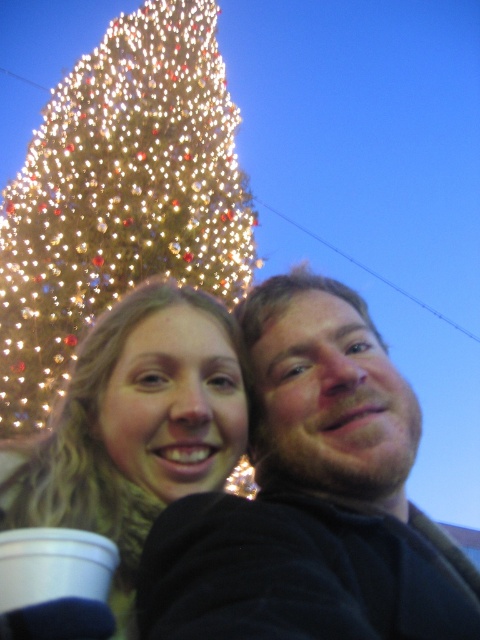
In the scene shown: You are taking a photo of the two individuals near the Christmas tree. To ensure both people are in frame, where should you position the camera relative to the dark brown hair at center?

The dark brown hair at center is located at point (310,509), so you should position the camera to include this central point to ensure both individuals are in frame.

You are a photographer trying to capture the perfect selfie. You have two people in the frame. One has dark brown hair at center. The other has long light brown hair. Where should you position your camera to ensure both people are in focus and centered?

To ensure both people are in focus and centered, position the camera so that the dark brown hair at center is at point [310,509] in the frame.

You are trying to take a photo of the dark brown hair at center and the illuminated glass christmas tree at upper left. Which object is wider?

The dark brown hair at center has a lesser width compared to the illuminated glass christmas tree at upper left, so the illuminated glass christmas tree at upper left is wider.